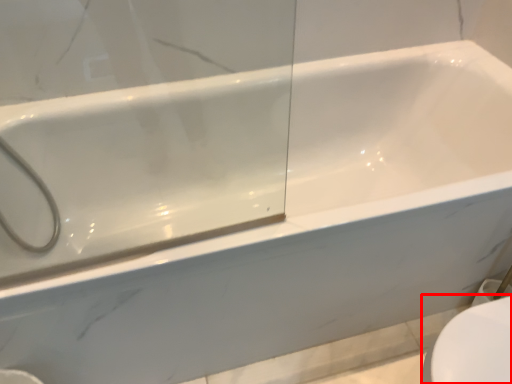
Question: From the image, what is the correct spatial relationship of toilet bowl (annotated by the red box) in relation to shower?

Choices:
 (A) left
 (B) right

Answer: (B)